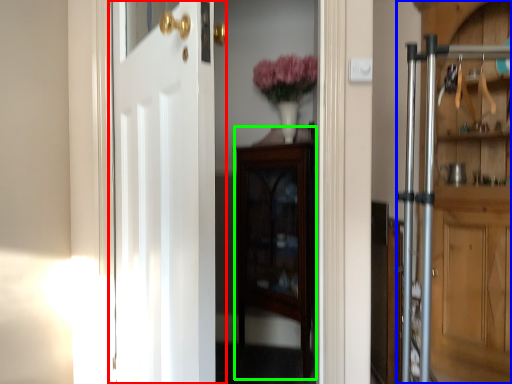
Question: Which object is positioned closest to door (highlighted by a red box)? Select from door (highlighted by a blue box) and cabinetry (highlighted by a green box).

Choices:
 (A) door
 (B) cabinetry

Answer: (B)